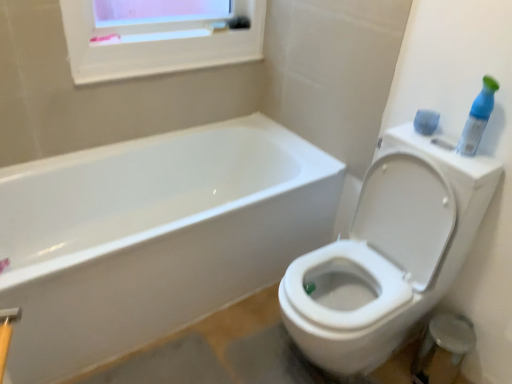
Question: Should I look upward or downward to see blue plastic spray bottle at upper right?

Choices:
 (A) up
 (B) down

Answer: (A)

Question: Is white glossy toilet at right closer to the viewer compared to blue plastic spray bottle at upper right?

Choices:
 (A) no
 (B) yes

Answer: (B)

Question: Would you say blue plastic spray bottle at upper right is part of white glossy toilet at right's contents?

Choices:
 (A) no
 (B) yes

Answer: (A)

Question: Is white glossy toilet at right oriented away from blue plastic spray bottle at upper right?

Choices:
 (A) yes
 (B) no

Answer: (B)

Question: Is white glossy toilet at right next to blue plastic spray bottle at upper right and touching it?

Choices:
 (A) no
 (B) yes

Answer: (A)

Question: Is white glossy toilet at right wider than blue plastic spray bottle at upper right?

Choices:
 (A) yes
 (B) no

Answer: (A)

Question: Considering the relative sizes of white glossy toilet at right and blue plastic spray bottle at upper right in the image provided, is white glossy toilet at right smaller than blue plastic spray bottle at upper right?

Choices:
 (A) yes
 (B) no

Answer: (B)

Question: Considering the relative sizes of blue plastic spray bottle at upper right and white glossy toilet at right in the image provided, is blue plastic spray bottle at upper right taller than white glossy toilet at right?

Choices:
 (A) yes
 (B) no

Answer: (B)

Question: From the image's perspective, is blue plastic spray bottle at upper right below white glossy toilet at right?

Choices:
 (A) no
 (B) yes

Answer: (A)

Question: Considering the relative sizes of blue plastic spray bottle at upper right and white glossy toilet at right in the image provided, is blue plastic spray bottle at upper right bigger than white glossy toilet at right?

Choices:
 (A) no
 (B) yes

Answer: (A)

Question: Is white glossy toilet at right a part of blue plastic spray bottle at upper right?

Choices:
 (A) no
 (B) yes

Answer: (A)

Question: From the image's perspective, is blue plastic spray bottle at upper right over white glossy toilet at right?

Choices:
 (A) no
 (B) yes

Answer: (B)

Question: Is the position of blue plastic spray bottle at upper right less distant than that of white glossy toilet at right?

Choices:
 (A) no
 (B) yes

Answer: (A)

Question: Based on their sizes in the image, would you say white glossy toilet at right is bigger or smaller than blue plastic spray bottle at upper right?

Choices:
 (A) big
 (B) small

Answer: (A)